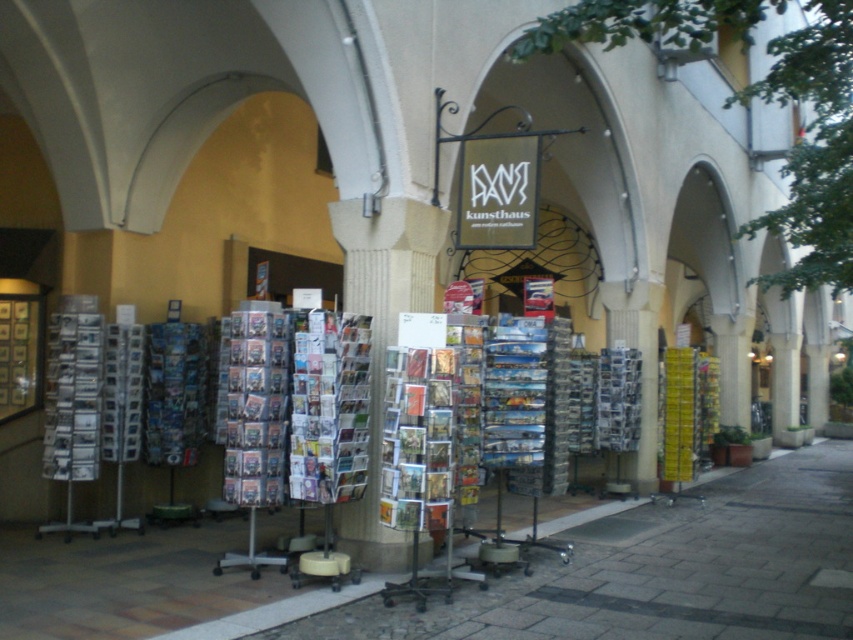
Question: Which point appears farthest from the camera in this image?

Choices:
 (A) (157, 592)
 (B) (317, 400)

Answer: (B)

Question: Does smooth stone pavement at center appear under printed paper cards at center?

Choices:
 (A) no
 (B) yes

Answer: (B)

Question: Is smooth stone pavement at center above printed paper cards at center?

Choices:
 (A) no
 (B) yes

Answer: (A)

Question: Does smooth stone pavement at center appear on the left side of printed paper cards at center?

Choices:
 (A) yes
 (B) no

Answer: (B)

Question: Which point is closer to the camera taking this photo?

Choices:
 (A) (292, 403)
 (B) (787, 584)

Answer: (A)

Question: Among these points, which one is farthest from the camera?

Choices:
 (A) (325, 442)
 (B) (740, 589)

Answer: (B)